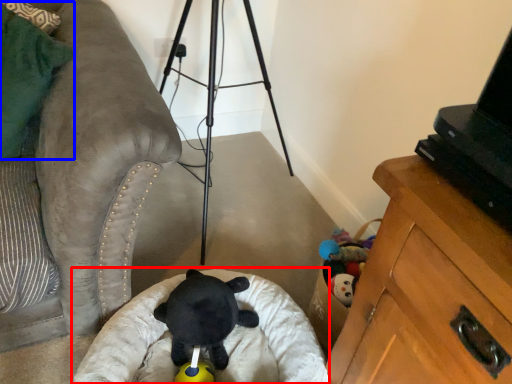
Question: Which object is further to the camera taking this photo, infant bed (highlighted by a red box) or pillow (highlighted by a blue box)?

Choices:
 (A) infant bed
 (B) pillow

Answer: (A)